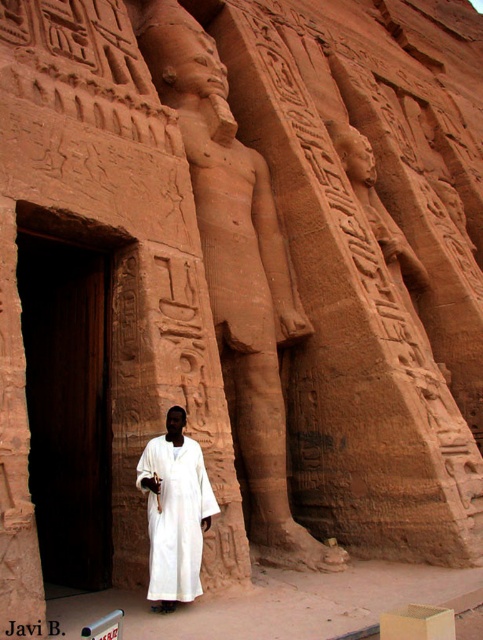
Question: Among these points, which one is nearest to the camera?

Choices:
 (A) (71, 586)
 (B) (203, 499)

Answer: (B)

Question: Observing the image, what is the correct spatial positioning of dark wood door at left in reference to white cotton robe at center?

Choices:
 (A) above
 (B) below

Answer: (A)

Question: Is dark wood door at left to the right of white cotton robe at center from the viewer's perspective?

Choices:
 (A) yes
 (B) no

Answer: (B)

Question: Is dark wood door at left above white cotton robe at center?

Choices:
 (A) no
 (B) yes

Answer: (B)